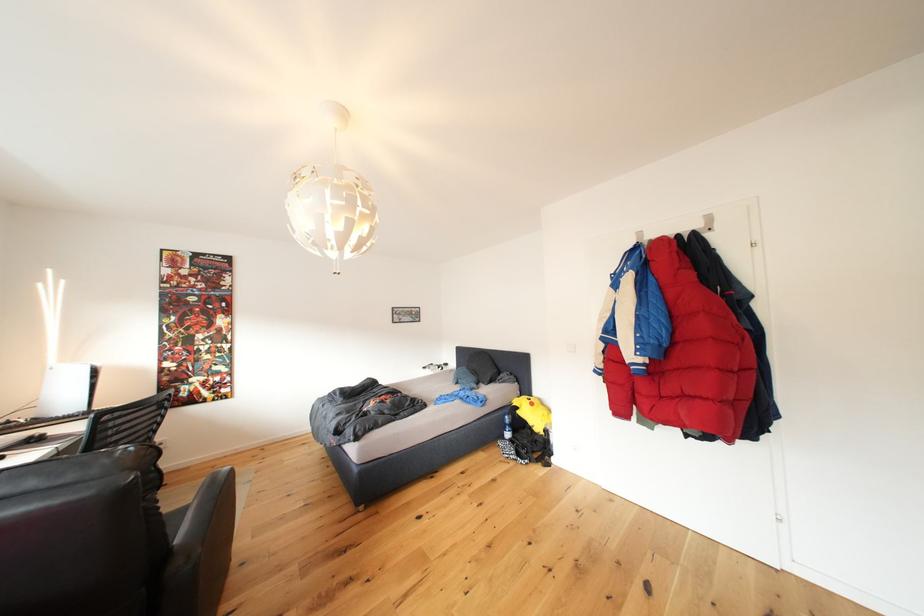
What are the coordinates of `black chair armrest` in the screenshot? It's located at (210, 505).